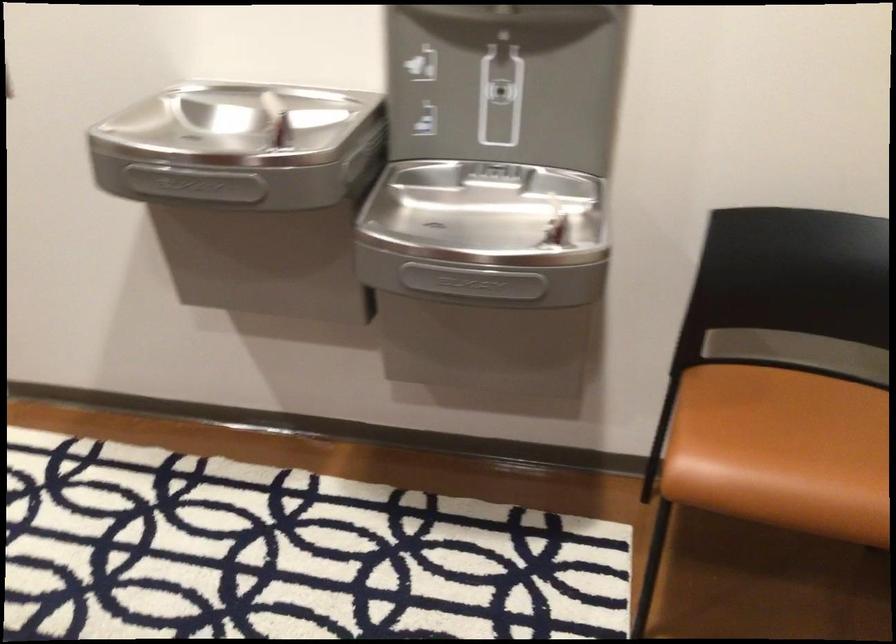
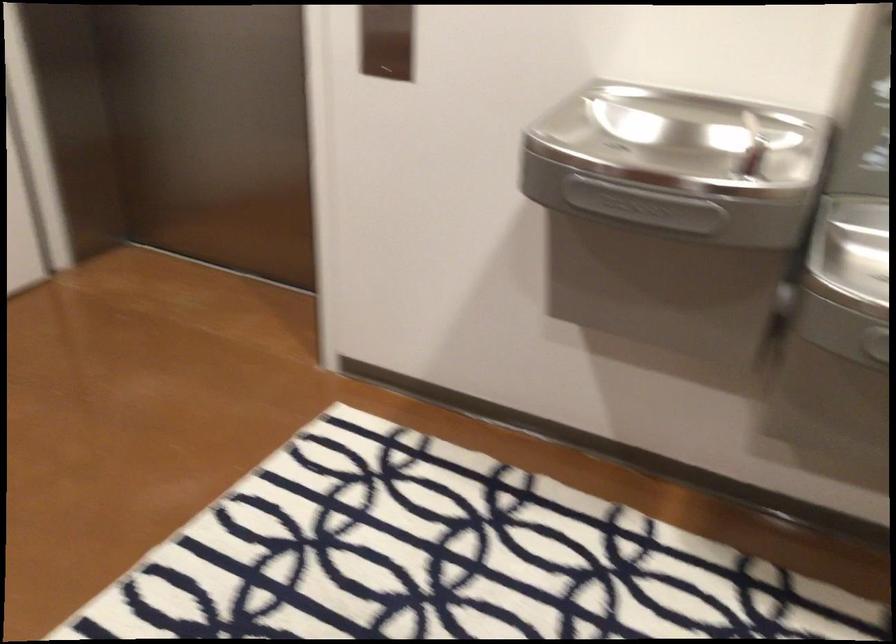
Question: The images are taken continuously from a first-person perspective. In which direction is your viewpoint rotating?

Choices:
 (A) Left
 (B) Right
 (C) Up
 (D) Down

Answer: (A)